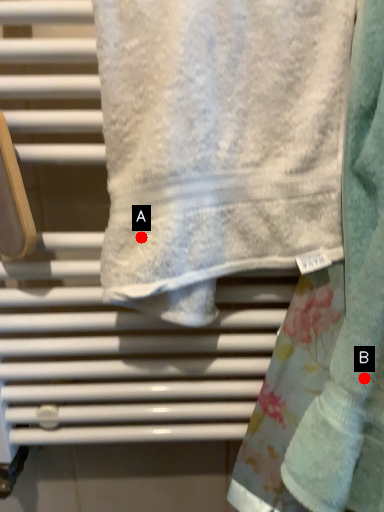
Question: Two points are circled on the image, labeled by A and B beside each circle. Which point appears farthest from the camera in this image?

Choices:
 (A) A is further
 (B) B is further

Answer: (A)